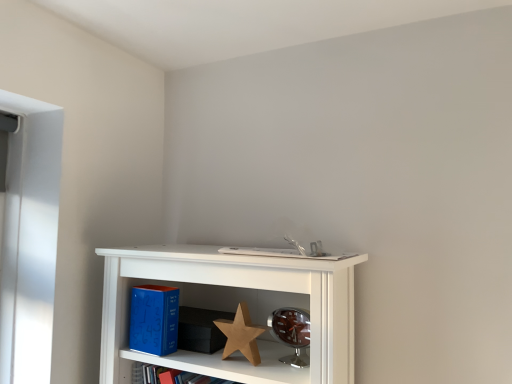
Find the location of a particular element. white matte book at center is located at coordinates (286, 253).

At what (x,y) coordinates should I click in order to perform the action: click on blue matte book at lower left. Please return your answer as a coordinate pair (x, y). The height and width of the screenshot is (384, 512). Looking at the image, I should click on (154, 319).

From the picture: Is white matte book at center taller or shorter than blue matte book at lower left?

white matte book at center is shorter than blue matte book at lower left.

Can you confirm if white matte book at center is wider than blue matte book at lower left?

Indeed, white matte book at center has a greater width compared to blue matte book at lower left.

Would you say white matte book at center is a long distance from blue matte book at lower left?

No.

Which of these two, white matte book at center or blue matte book at lower left, is smaller?

With smaller size is blue matte book at lower left.

In the scene shown: From the image's perspective, which one is positioned lower, wooden star at center or blue matte book at lower left?

From the image's view, wooden star at center is below.

From a real-world perspective, is wooden star at center located beneath blue matte book at lower left?

Yes.

Would you say wooden star at center is to the left or to the right of blue matte book at lower left in the picture?

wooden star at center is to the right of blue matte book at lower left.

Is wooden star at center touching blue matte book at lower left?

No, wooden star at center is not next to blue matte book at lower left.

Is white matte book at center looking in the opposite direction of wooden star at center?

No.

Is white matte book at center bigger or smaller than wooden star at center?

In the image, white matte book at center appears to be larger than wooden star at center.

Is point (321, 252) closer or farther from the camera than point (247, 311)?

Point (321, 252) is farther from the camera than point (247, 311).

Looking at this image, is the depth of white matte book at center greater than that of wooden star at center?

Yes, white matte book at center is further from the camera.

Is point (253, 351) positioned in front of point (301, 247)?

Yes, it is in front of point (301, 247).

Is wooden star at center not close to white matte book at center?

No, there isn't a large distance between wooden star at center and white matte book at center.

From a real-world perspective, is wooden star at center on top of white matte book at center?

Incorrect, from a real-world perspective, wooden star at center is lower than white matte book at center.

Are blue matte book at lower left and wooden star at center far apart?

No, blue matte book at lower left is not far away from wooden star at center.

Is blue matte book at lower left bigger than wooden star at center?

Yes, blue matte book at lower left is bigger than wooden star at center.

In the scene shown: Does blue matte book at lower left turn towards wooden star at center?

No, blue matte book at lower left does not turn towards wooden star at center.

Does blue matte book at lower left contain wooden star at center?

No, wooden star at center is not inside blue matte book at lower left.

Can you confirm if blue matte book at lower left is wider than white matte book at center?

In fact, blue matte book at lower left might be narrower than white matte book at center.

Is blue matte book at lower left closer to the viewer compared to white matte book at center?

No, blue matte book at lower left is further to the viewer.

From a real-world perspective, relative to white matte book at center, is blue matte book at lower left vertically above or below?

In terms of real-world spatial position, blue matte book at lower left is below white matte book at center.

Image resolution: width=512 pixels, height=384 pixels. What are the coordinates of `book above the blue matte book at lower left (from a real-world perspective)` in the screenshot? It's located at (286, 253).

Where is `book above the blue matte book at lower left (from the image's perspective)`? Image resolution: width=512 pixels, height=384 pixels. book above the blue matte book at lower left (from the image's perspective) is located at coordinates (286, 253).

Image resolution: width=512 pixels, height=384 pixels. Identify the location of star in front of the blue matte book at lower left. (241, 335).

Based on their spatial positions, is white matte book at center or wooden star at center further from blue matte book at lower left?

white matte book at center.

Which object lies further to the anchor point white matte book at center, blue matte book at lower left or wooden star at center?

blue matte book at lower left.

Looking at the image, which one is located closer to wooden star at center, white matte book at center or blue matte book at lower left?

blue matte book at lower left.

Estimate the real-world distances between objects in this image. Which object is further from white matte book at center, wooden star at center or blue matte book at lower left?

Among the two, blue matte book at lower left is located further to white matte book at center.

When comparing their distances from blue matte book at lower left, does wooden star at center or white matte book at center seem further?

white matte book at center lies further to blue matte book at lower left than the other object.

Looking at the image, which one is located further to wooden star at center, blue matte book at lower left or white matte book at center?

white matte book at center is further to wooden star at center.

You are a GUI agent. You are given a task and a screenshot of the screen. Output one action in this format:
    pyautogui.click(x=<x>, y=<y>)
    Task: Click on the star between blue matte book at lower left and white matte book at center in the horizontal direction
    This screenshot has width=512, height=384.
    Given the screenshot: What is the action you would take?
    pyautogui.click(x=241, y=335)